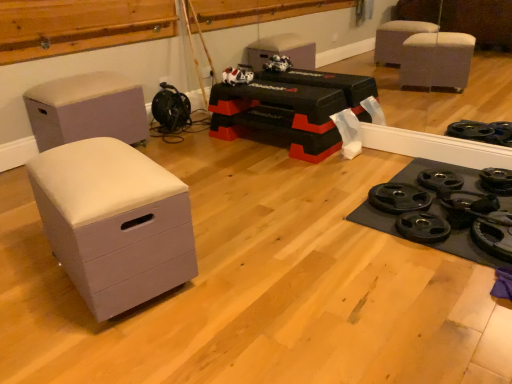
Question: From the image's perspective, would you say black rubber weight plate at lower right is positioned over beige fabric ottoman at left?

Choices:
 (A) no
 (B) yes

Answer: (A)

Question: Is the position of black rubber weight plate at lower right less distant than that of beige fabric ottoman at left?

Choices:
 (A) no
 (B) yes

Answer: (B)

Question: Does black rubber weight plate at lower right contain beige fabric ottoman at left?

Choices:
 (A) yes
 (B) no

Answer: (B)

Question: Are black rubber weight plate at lower right and beige fabric ottoman at left making contact?

Choices:
 (A) yes
 (B) no

Answer: (B)

Question: Is black rubber weight plate at lower right at the right side of beige fabric ottoman at left?

Choices:
 (A) yes
 (B) no

Answer: (A)

Question: From a real-world perspective, relative to white plush cat at center, is black rubber weight plate at lower right vertically above or below?

Choices:
 (A) above
 (B) below

Answer: (B)

Question: From the image's perspective, is black rubber weight plate at lower right positioned above or below white plush cat at center?

Choices:
 (A) below
 (B) above

Answer: (A)

Question: In the image, is black rubber weight plate at lower right positioned in front of or behind white plush cat at center?

Choices:
 (A) behind
 (B) front

Answer: (B)

Question: Which is correct: black rubber weight plate at lower right is inside white plush cat at center, or outside of it?

Choices:
 (A) inside
 (B) outside

Answer: (B)

Question: In terms of size, does beige fabric ottoman at left appear bigger or smaller than white matte chest of drawers at left?

Choices:
 (A) big
 (B) small

Answer: (A)

Question: Is point (128, 84) closer or farther from the camera than point (62, 152)?

Choices:
 (A) closer
 (B) farther

Answer: (B)

Question: Looking at their shapes, would you say beige fabric ottoman at left is wider or thinner than white matte chest of drawers at left?

Choices:
 (A) thin
 (B) wide

Answer: (B)

Question: Is beige fabric ottoman at left spatially inside white matte chest of drawers at left, or outside of it?

Choices:
 (A) inside
 (B) outside

Answer: (B)

Question: From the image's perspective, is white plush cat at center positioned above or below white matte chest of drawers at left?

Choices:
 (A) below
 (B) above

Answer: (B)

Question: In terms of height, does white plush cat at center look taller or shorter compared to white matte chest of drawers at left?

Choices:
 (A) tall
 (B) short

Answer: (B)